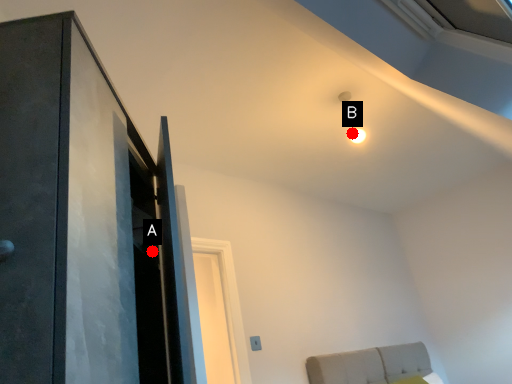
Question: Two points are circled on the image, labeled by A and B beside each circle. Which point is closer to the camera?

Choices:
 (A) A is closer
 (B) B is closer

Answer: (A)